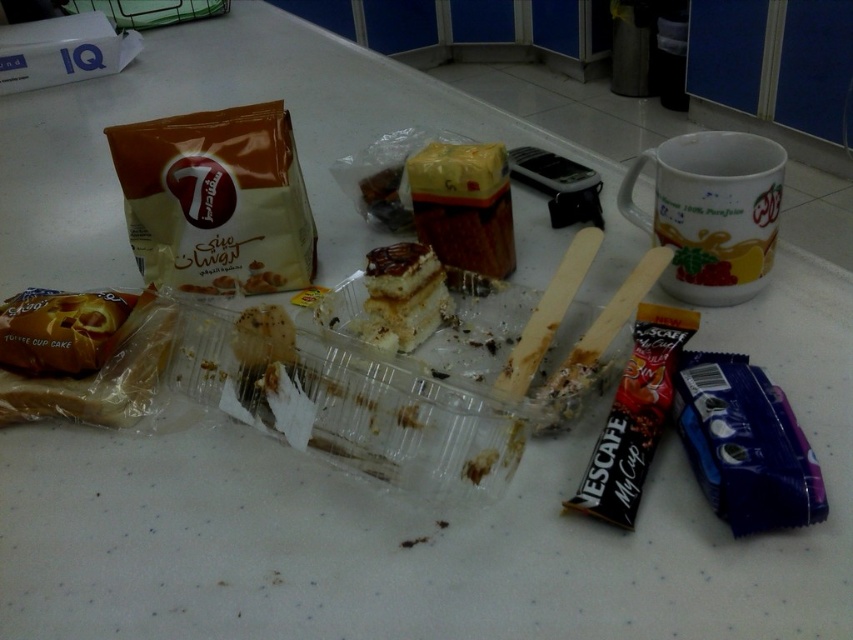
Based on the photo, can you confirm if matte plastic bag at upper left is wider than spongy yellow cake at center?

Indeed, matte plastic bag at upper left has a greater width compared to spongy yellow cake at center.

Is point (276, 182) closer to camera compared to point (367, 266)?

No, (276, 182) is further to viewer.

Between point (218, 173) and point (397, 253), which one is positioned in front?

Point (397, 253)

Find the location of a particular element. Image resolution: width=853 pixels, height=640 pixels. matte plastic bag at upper left is located at coordinates (218, 198).

Can you confirm if golden plastic cupcake at lower left is thinner than spongy yellow cake at center?

Incorrect, golden plastic cupcake at lower left's width is not less than spongy yellow cake at center's.

Is golden plastic cupcake at lower left bigger than spongy yellow cake at center?

Correct, golden plastic cupcake at lower left is larger in size than spongy yellow cake at center.

Between point (55, 401) and point (425, 275), which one is positioned behind?

The point (425, 275) is behind.

Locate an element on the screen. golden plastic cupcake at lower left is located at coordinates (99, 376).

Does yellow plastic container at center have a lesser height compared to spongy yellow cake at center?

Incorrect, yellow plastic container at center's height does not fall short of spongy yellow cake at center's.

Between yellow plastic container at center and spongy yellow cake at center, which one appears on the right side from the viewer's perspective?

From the viewer's perspective, yellow plastic container at center appears more on the right side.

Find the location of a particular element. The height and width of the screenshot is (640, 853). yellow plastic container at center is located at coordinates (463, 205).